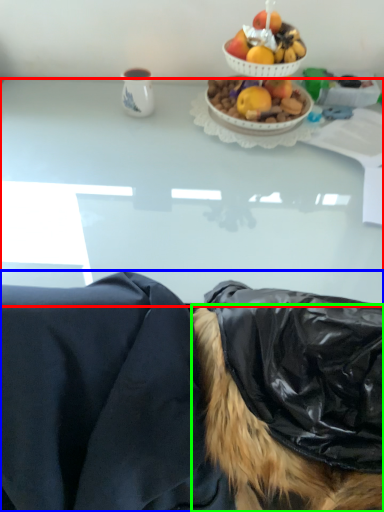
Question: Estimate the real-world distances between objects in this image. Which object is farther from desk (highlighted by a red box), person (highlighted by a blue box) or wig (highlighted by a green box)?

Choices:
 (A) person
 (B) wig

Answer: (B)